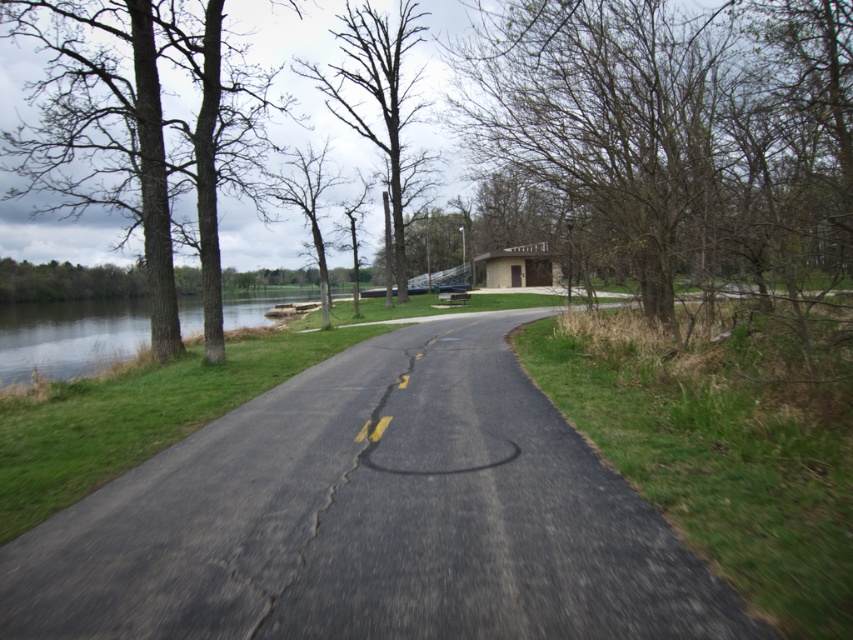
Looking at this image, you are standing on the paved path and want to take a photo of both the brown leafless tree at upper right and the brown rough tree at left. Which direction should you face to include both trees in your camera frame?

To include both the brown leafless tree at upper right and the brown rough tree at left in your camera frame, you should face to the right since the brown leafless tree at upper right is positioned to the right of the brown rough tree at left.